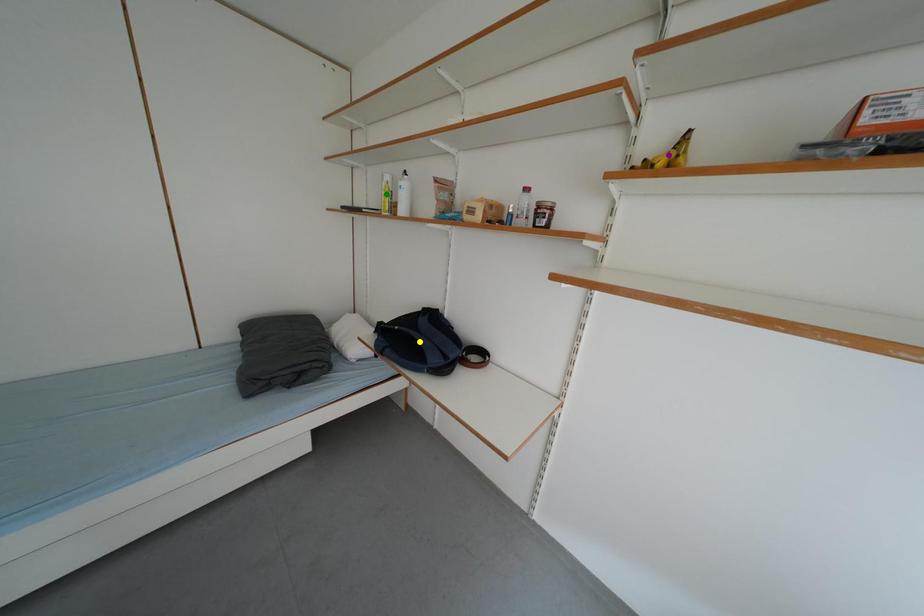
Order these from nearest to farthest:
- yellow point
- green point
- purple point

1. green point
2. yellow point
3. purple point